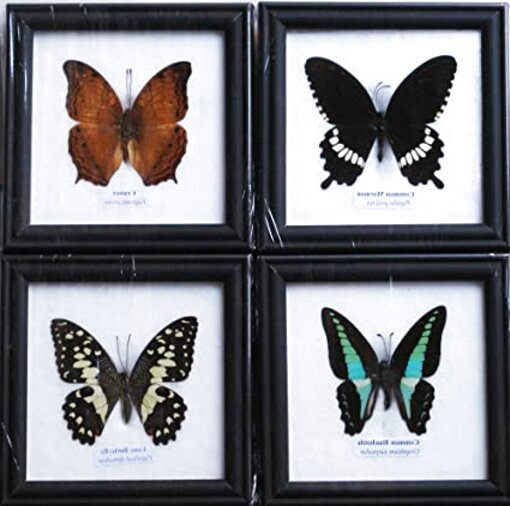
The image size is (510, 506). I want to click on white background mat, so click(x=196, y=110), click(x=312, y=172), click(x=173, y=301), click(x=308, y=356).